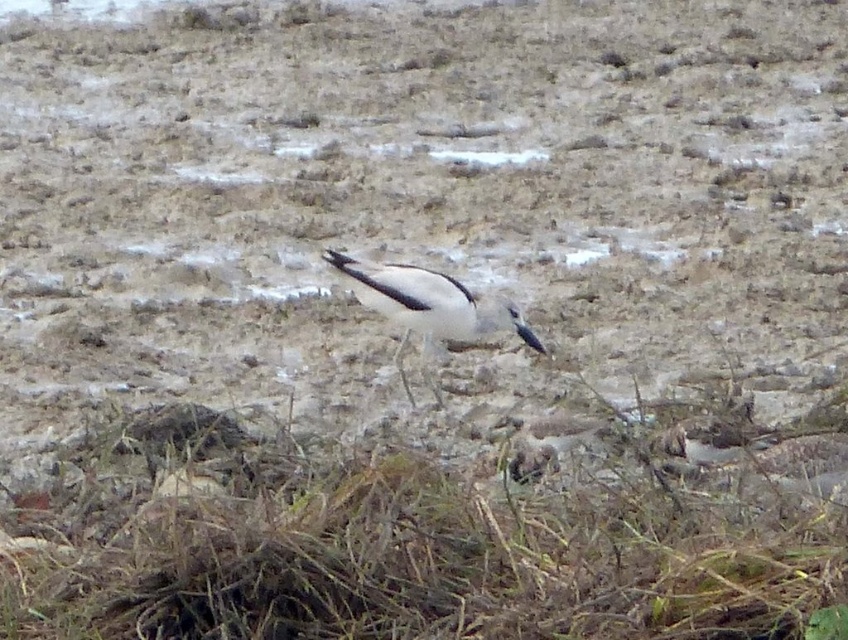
You are a photographer aiming to capture the white matte bird at center while ensuring the brown dry grass at lower center is visible in the frame. Which side of the bird should you position the grass to achieve this?

The brown dry grass at lower center is positioned on the right side of the white matte bird at center, so you should position the grass to the right of the bird to include it in the frame.

You are a photographer trying to capture the white matte bird at center. You notice the brown dry grass at lower center is blocking your view. Can you move closer to the bird without stepping on the grass?

The brown dry grass at lower center is closer to the viewer than the white matte bird at center. Therefore, moving closer to the bird would require stepping over or around the grass, as it is in front of the bird.